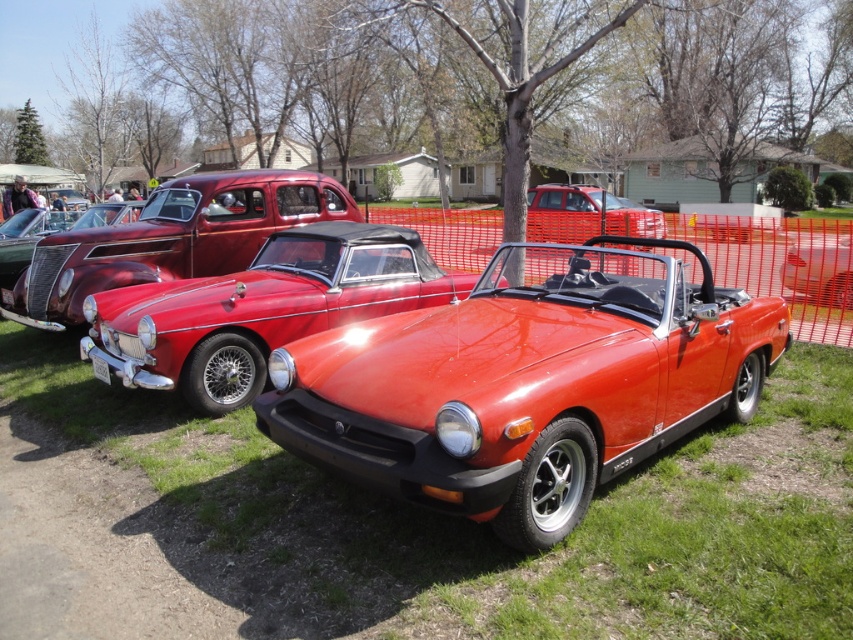
Between shiny red convertible at center and glossy red convertible at center, which one appears on the left side from the viewer's perspective?

From the viewer's perspective, glossy red convertible at center appears more on the left side.

Does shiny red convertible at center have a larger size compared to glossy red convertible at center?

Indeed, shiny red convertible at center has a larger size compared to glossy red convertible at center.

Is point (518, 381) positioned behind point (223, 356)?

That is False.

You are a GUI agent. You are given a task and a screenshot of the screen. Output one action in this format:
    pyautogui.click(x=<x>, y=<y>)
    Task: Click on the shiny red convertible at center
    
    Given the screenshot: What is the action you would take?
    pyautogui.click(x=526, y=381)

Consider the image. Does shiny red convertible at center lie behind metallic red convertible at center?

No, shiny red convertible at center is closer to the viewer.

Measure the distance between point (548, 419) and camera.

Point (548, 419) is 3.30 meters from camera.

Identify the location of shiny red convertible at center. The image size is (853, 640). (526, 381).

Does glossy red convertible at center appear on the right side of metallic red convertible at center?

Incorrect, glossy red convertible at center is not on the right side of metallic red convertible at center.

Where is `glossy red convertible at center`? Image resolution: width=853 pixels, height=640 pixels. glossy red convertible at center is located at coordinates (259, 308).

The height and width of the screenshot is (640, 853). Identify the location of glossy red convertible at center. (259, 308).